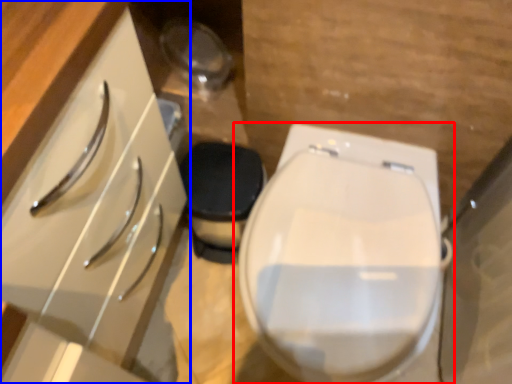
Question: Which object appears closest to the camera in this image, toilet (highlighted by a red box) or cabinetry (highlighted by a blue box)?

Choices:
 (A) toilet
 (B) cabinetry

Answer: (B)